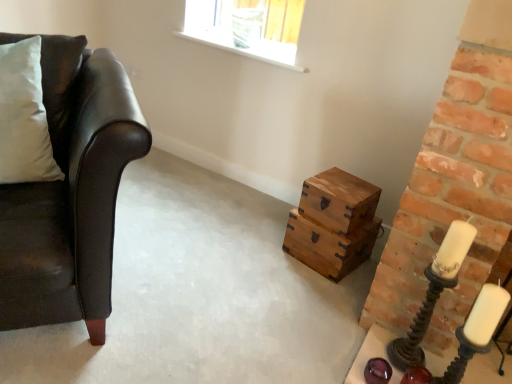
Identify the location of wooden box at center. The image size is (512, 384). (339, 200).

This screenshot has height=384, width=512. Describe the element at coordinates (485, 314) in the screenshot. I see `white wax candle at right` at that location.

Describe the element at coordinates (433, 293) in the screenshot. I see `metallic spiral candle holder at right, which is the 1th candle holder in left-to-right order` at that location.

This screenshot has height=384, width=512. Describe the element at coordinates (333, 223) in the screenshot. I see `wooden chest at center-right` at that location.

You are a GUI agent. You are given a task and a screenshot of the screen. Output one action in this format:
    pyautogui.click(x=<x>, y=<y>)
    Task: Click on the matte black leather couch at left
    This screenshot has width=512, height=384.
    Given the screenshot: What is the action you would take?
    pyautogui.click(x=71, y=194)

Image resolution: width=512 pixels, height=384 pixels. Identify the location of pillow that appears on the left of metallic spiral candle holder at right, which is the 1th candle holder in left-to-right order. (24, 117).

How many degrees apart are the facing directions of white soft pillow at left and metallic spiral candle holder at right, which is the 1th candle holder in left-to-right order?

white soft pillow at left and metallic spiral candle holder at right, which is the 1th candle holder in left-to-right order, are facing 46.7 degrees away from each other.

Is white soft pillow at left inside or outside of metallic spiral candle holder at right, the second candle holder in the right-to-left sequence?

white soft pillow at left is outside metallic spiral candle holder at right, the second candle holder in the right-to-left sequence.

Between white soft pillow at left and metallic spiral candle holder at right, the second candle holder in the right-to-left sequence, which one has smaller size?

With smaller size is metallic spiral candle holder at right, the second candle holder in the right-to-left sequence.

Which point is more forward, (349, 183) or (27, 180)?

The point (27, 180) is in front.

Based on the photo, considering the positions of objects wooden chest at center-right and white soft pillow at left in the image provided, who is behind, wooden chest at center-right or white soft pillow at left?

wooden chest at center-right is further away from the camera.

Considering the sizes of objects wooden chest at center-right and white soft pillow at left in the image provided, who is taller, wooden chest at center-right or white soft pillow at left?

Standing taller between the two is white soft pillow at left.

Does wooden chest at center-right turn towards white soft pillow at left?

No, wooden chest at center-right is not oriented towards white soft pillow at left.

Considering the relative sizes of wooden box at center and white soft pillow at left in the image provided, is wooden box at center wider than white soft pillow at left?

Correct, the width of wooden box at center exceeds that of white soft pillow at left.

What's the angular difference between wooden box at center and white soft pillow at left's facing directions?

The angle between the facing direction of wooden box at center and the facing direction of white soft pillow at left is 58.5 degrees.

Does wooden box at center have a lesser height compared to white soft pillow at left?

Yes.

Consider the image. Would you say wooden box at center contains white soft pillow at left?

No.

Looking at this image, from the image's perspective, relative to white wax candle at right, is metallic spiral candle holder at right, which is the 1th candle holder in left-to-right order, above or below?

Clearly, from the image's perspective, metallic spiral candle holder at right, which is the 1th candle holder in left-to-right order, is above white wax candle at right.

Between metallic spiral candle holder at right, which is the 1th candle holder in left-to-right order, and white wax candle at right, which one appears on the right side from the viewer's perspective?

From the viewer's perspective, white wax candle at right appears more on the right side.

Does metallic spiral candle holder at right, which is the 1th candle holder in left-to-right order, touch white wax candle at right?

No, metallic spiral candle holder at right, which is the 1th candle holder in left-to-right order, is not making contact with white wax candle at right.

Considering the relative sizes of metallic spiral candle holder at right, the second candle holder in the right-to-left sequence, and white wax candle at right in the image provided, is metallic spiral candle holder at right, the second candle holder in the right-to-left sequence, wider than white wax candle at right?

Yes.

What's the angular difference between wooden box at center and metallic spiral candle holder at right, the second candle holder in the right-to-left sequence,'s facing directions?

11.8 degrees separate the facing orientations of wooden box at center and metallic spiral candle holder at right, the second candle holder in the right-to-left sequence.

Considering the relative sizes of wooden box at center and metallic spiral candle holder at right, which is the 1th candle holder in left-to-right order, in the image provided, is wooden box at center bigger than metallic spiral candle holder at right, which is the 1th candle holder in left-to-right order,?

Yes.

Is wooden box at center oriented towards metallic spiral candle holder at right, the second candle holder in the right-to-left sequence?

No, wooden box at center is not turned towards metallic spiral candle holder at right, the second candle holder in the right-to-left sequence.

Is metallic spiral candle holder at right, which is the 1th candle holder in left-to-right order, inside wooden box at center?

That's incorrect, metallic spiral candle holder at right, which is the 1th candle holder in left-to-right order, is not inside wooden box at center.

Does matte black candle holder at right, the second candle holder from the left, appear on the right side of matte black leather couch at left?

Yes, matte black candle holder at right, the second candle holder from the left, is to the right of matte black leather couch at left.

Between matte black candle holder at right, the second candle holder from the left, and matte black leather couch at left, which one has smaller width?

matte black candle holder at right, the second candle holder from the left, is thinner.

Is matte black candle holder at right, the second candle holder from the left, in contact with matte black leather couch at left?

matte black candle holder at right, the second candle holder from the left, is not next to matte black leather couch at left, and they're not touching.

Is matte black candle holder at right, the 1th candle holder in the right-to-left sequence, turned away from matte black leather couch at left?

matte black candle holder at right, the 1th candle holder in the right-to-left sequence, is not turned away from matte black leather couch at left.

Is white wax candle at right taller or shorter than matte black candle holder at right, the second candle holder from the left?

Clearly, white wax candle at right is shorter compared to matte black candle holder at right, the second candle holder from the left.

Is white wax candle at right at the right side of matte black candle holder at right, the second candle holder from the left?

Yes, white wax candle at right is to the right of matte black candle holder at right, the second candle holder from the left.

In the scene shown: Are white wax candle at right and matte black candle holder at right, the second candle holder from the left, far apart?

No, white wax candle at right is in close proximity to matte black candle holder at right, the second candle holder from the left.

Is the position of white wax candle at right more distant than that of matte black candle holder at right, the 1th candle holder in the right-to-left sequence?

Yes, it is behind matte black candle holder at right, the 1th candle holder in the right-to-left sequence.

The height and width of the screenshot is (384, 512). Identify the location of pillow lying in front of the metallic spiral candle holder at right, which is the 1th candle holder in left-to-right order. (24, 117).

Where is `crate on the right of white soft pillow at left`? The width and height of the screenshot is (512, 384). crate on the right of white soft pillow at left is located at coordinates (333, 223).

Looking at the image, which one is located closer to wooden chest at center-right, white soft pillow at left or metallic spiral candle holder at right, which is the 1th candle holder in left-to-right order?

Based on the image, metallic spiral candle holder at right, which is the 1th candle holder in left-to-right order, appears to be nearer to wooden chest at center-right.

In the scene shown: Looking at the image, which one is located further to wooden box at center, matte black candle holder at right, the 1th candle holder in the right-to-left sequence, or white wax candle at right?

The object further to wooden box at center is white wax candle at right.

When comparing their distances from matte black candle holder at right, the second candle holder from the left, does white wax candle at right or matte black leather couch at left seem further?

matte black leather couch at left is further to matte black candle holder at right, the second candle holder from the left.

When comparing their distances from matte black leather couch at left, does metallic spiral candle holder at right, the second candle holder in the right-to-left sequence, or white soft pillow at left seem closer?

white soft pillow at left is closer to matte black leather couch at left.

From the image, which object appears to be nearer to white wax candle at right, white soft pillow at left or matte black candle holder at right, the second candle holder from the left?

Based on the image, matte black candle holder at right, the second candle holder from the left, appears to be nearer to white wax candle at right.

Which object lies further to the anchor point matte black candle holder at right, the 1th candle holder in the right-to-left sequence, matte black leather couch at left or white soft pillow at left?

white soft pillow at left is further to matte black candle holder at right, the 1th candle holder in the right-to-left sequence.

Looking at the image, which one is located closer to wooden chest at center-right, wooden box at center or matte black candle holder at right, the 1th candle holder in the right-to-left sequence?

Based on the image, wooden box at center appears to be nearer to wooden chest at center-right.

Based on their spatial positions, is wooden box at center or metallic spiral candle holder at right, which is the 1th candle holder in left-to-right order, closer to wooden chest at center-right?

The object closer to wooden chest at center-right is wooden box at center.

Find the location of a particular element. box positioned between metallic spiral candle holder at right, the second candle holder in the right-to-left sequence, and wooden chest at center-right from near to far is located at coordinates (339, 200).

In order to click on box between matte black candle holder at right, the 1th candle holder in the right-to-left sequence, and wooden chest at center-right, along the z-axis in this screenshot , I will do `click(339, 200)`.

Find the location of `candle between metallic spiral candle holder at right, which is the 1th candle holder in left-to-right order, and wooden chest at center-right in the front-back direction`. candle between metallic spiral candle holder at right, which is the 1th candle holder in left-to-right order, and wooden chest at center-right in the front-back direction is located at coordinates (485, 314).

You are a GUI agent. You are given a task and a screenshot of the screen. Output one action in this format:
    pyautogui.click(x=<x>, y=<y>)
    Task: Click on the candle holder located between metallic spiral candle holder at right, the second candle holder in the right-to-left sequence, and white wax candle at right in the left-right direction
    This screenshot has width=512, height=384.
    Given the screenshot: What is the action you would take?
    tap(476, 331)